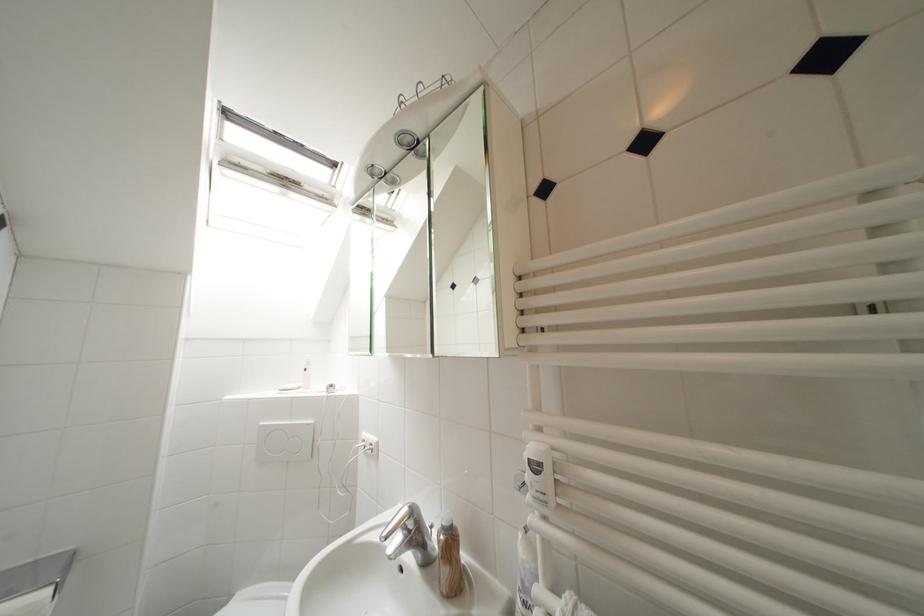
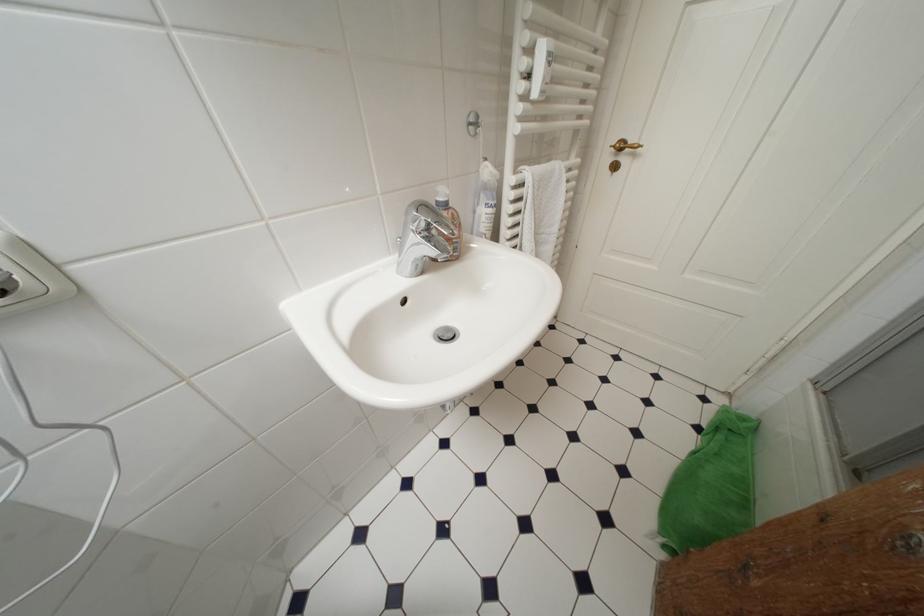
How did the camera likely rotate?

The camera's rotation is toward right-down.